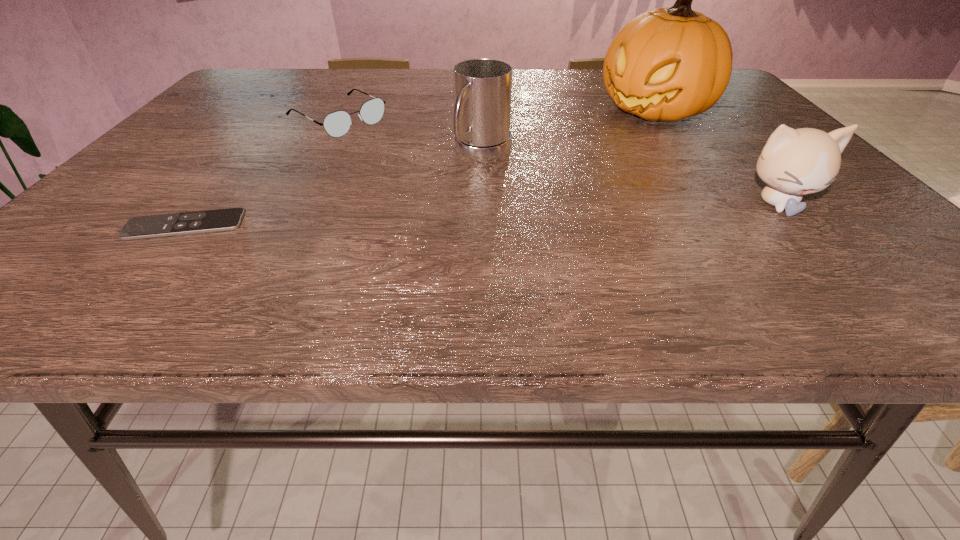
In order to click on empty space between the mug and the pumpkin in this screenshot , I will do `click(568, 132)`.

The image size is (960, 540). In order to click on vacant space that is in between the mug and the pumpkin in this screenshot , I will do `click(568, 132)`.

Where is `free spot between the tallest object and the remote control`? The width and height of the screenshot is (960, 540). free spot between the tallest object and the remote control is located at coordinates (420, 168).

At what (x,y) coordinates should I click in order to perform the action: click on free space between the kitten and the mug. Please return your answer as a coordinate pair (x, y). Looking at the image, I should click on (630, 179).

Identify the location of free space between the tallest object and the kitten. The height and width of the screenshot is (540, 960). (715, 157).

You are a GUI agent. You are given a task and a screenshot of the screen. Output one action in this format:
    pyautogui.click(x=<x>, y=<y>)
    Task: Click on the free space between the third object from right to left and the remote control
    
    Given the screenshot: What is the action you would take?
    pyautogui.click(x=334, y=190)

At what (x,y) coordinates should I click in order to perform the action: click on free space between the second shortest object and the kitten. Please return your answer as a coordinate pair (x, y). Looking at the image, I should click on (558, 161).

You are a GUI agent. You are given a task and a screenshot of the screen. Output one action in this format:
    pyautogui.click(x=<x>, y=<y>)
    Task: Click on the object that ranks as the second closest to the pumpkin
    The height and width of the screenshot is (540, 960).
    Given the screenshot: What is the action you would take?
    pyautogui.click(x=482, y=87)

Identify which object is located as the second nearest to the mug. Please provide its 2D coordinates. Your answer should be formatted as a tuple, i.e. [(x, y)], where the tuple contains the x and y coordinates of a point satisfying the conditions above.

[(667, 64)]

Identify the location of free point that satisfies the following two spatial constraints: 1. on the back side of the tallest object; 2. on the left side of the spectacles. (343, 111).